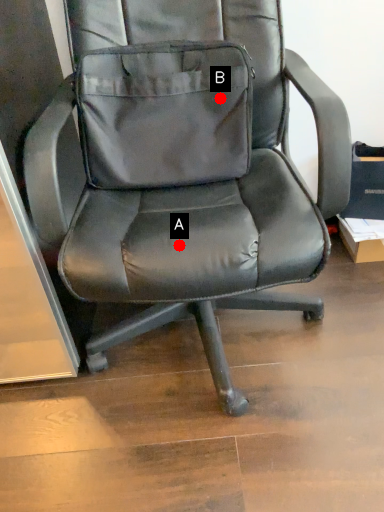
Question: Two points are circled on the image, labeled by A and B beside each circle. Which of the following is the closest to the observer?

Choices:
 (A) A is closer
 (B) B is closer

Answer: (A)